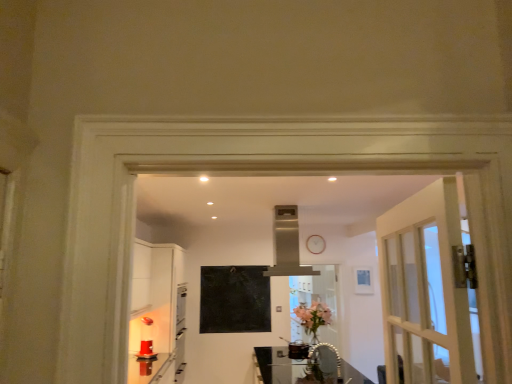
Question: Is clear glass screen door at center smaller than matte black bulletin board at center?

Choices:
 (A) yes
 (B) no

Answer: (B)

Question: From the image's perspective, is clear glass screen door at center below matte black bulletin board at center?

Choices:
 (A) no
 (B) yes

Answer: (B)

Question: Is clear glass screen door at center thinner than matte black bulletin board at center?

Choices:
 (A) yes
 (B) no

Answer: (B)

Question: Is clear glass screen door at center at the left side of matte black bulletin board at center?

Choices:
 (A) no
 (B) yes

Answer: (A)

Question: Is matte black bulletin board at center inside clear glass screen door at center?

Choices:
 (A) no
 (B) yes

Answer: (A)

Question: Is pink glass vase at center wider or thinner than satin silver exhaust hood at center?

Choices:
 (A) wide
 (B) thin

Answer: (B)

Question: Is pink glass vase at center inside or outside of satin silver exhaust hood at center?

Choices:
 (A) outside
 (B) inside

Answer: (A)

Question: In terms of height, does pink glass vase at center look taller or shorter compared to satin silver exhaust hood at center?

Choices:
 (A) short
 (B) tall

Answer: (A)

Question: From the image's perspective, is pink glass vase at center above or below satin silver exhaust hood at center?

Choices:
 (A) below
 (B) above

Answer: (A)

Question: From the image's perspective, is matte black bulletin board at center above or below clear glass screen door at center?

Choices:
 (A) below
 (B) above

Answer: (B)

Question: Considering the positions of matte black bulletin board at center and clear glass screen door at center in the image, is matte black bulletin board at center wider or thinner than clear glass screen door at center?

Choices:
 (A) wide
 (B) thin

Answer: (B)

Question: Does point (252, 324) appear closer or farther from the camera than point (314, 367)?

Choices:
 (A) closer
 (B) farther

Answer: (A)

Question: Is matte black bulletin board at center inside the boundaries of clear glass screen door at center, or outside?

Choices:
 (A) outside
 (B) inside

Answer: (A)

Question: Is clear glass table at center taller or shorter than satin silver exhaust hood at center?

Choices:
 (A) tall
 (B) short

Answer: (B)

Question: From the image's perspective, relative to satin silver exhaust hood at center, is clear glass table at center above or below?

Choices:
 (A) above
 (B) below

Answer: (B)